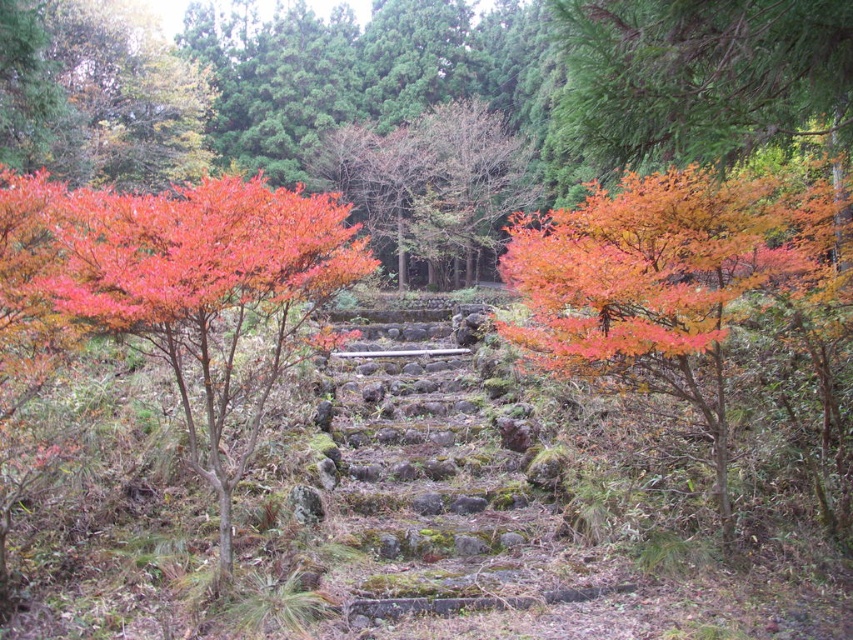
You are a hiker planning to walk up the stone steps in the forest. You notice two maple trees nearby. Which maple tree, the shiny orange maple at center or the shiny red maple tree at left, is narrower in width?

The shiny orange maple at center has a lesser width compared to the shiny red maple tree at left, so it is narrower.

A hiker wants to place a 10 feet long wooden bench between the shiny orange maple at center and the shiny red maple tree at left. Is there enough space for the bench to fit between them?

The shiny orange maple at center is 12.21 feet from the shiny red maple tree at left, so yes, the bench can fit between them since the distance is greater than the bench length.

You are standing at the base of the stone steps in the forest. A treasure map indicates that a hidden gem is located at point (723, 193). If you start walking straight up the steps, how far in feet will you have to walk to reach the hidden gem?

The point (723, 193) is 19.83 feet away from the viewer, so you will have to walk 19.83 feet straight up the steps to reach the hidden gem.